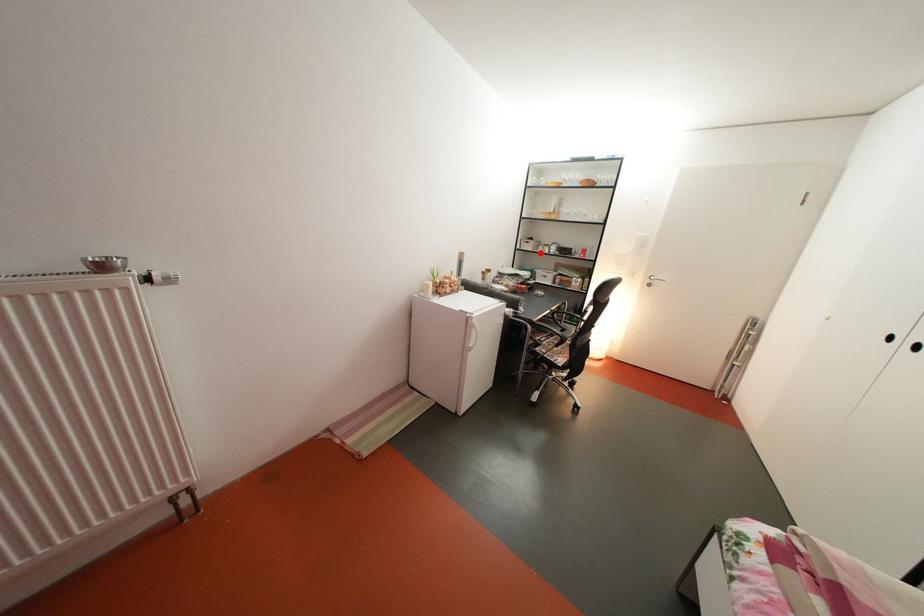
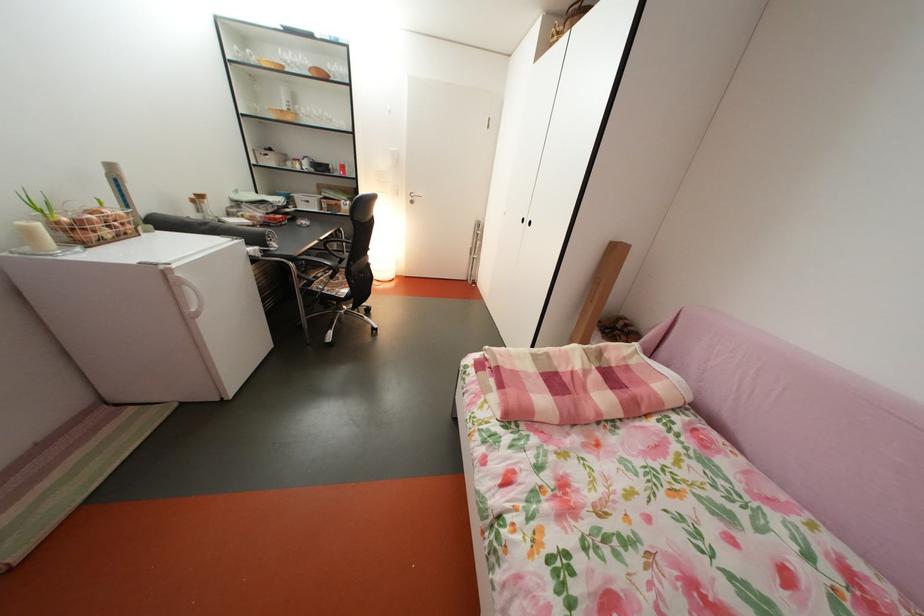
Find the pixel in the second image that matches the highlighted location in the first image.

(283, 168)